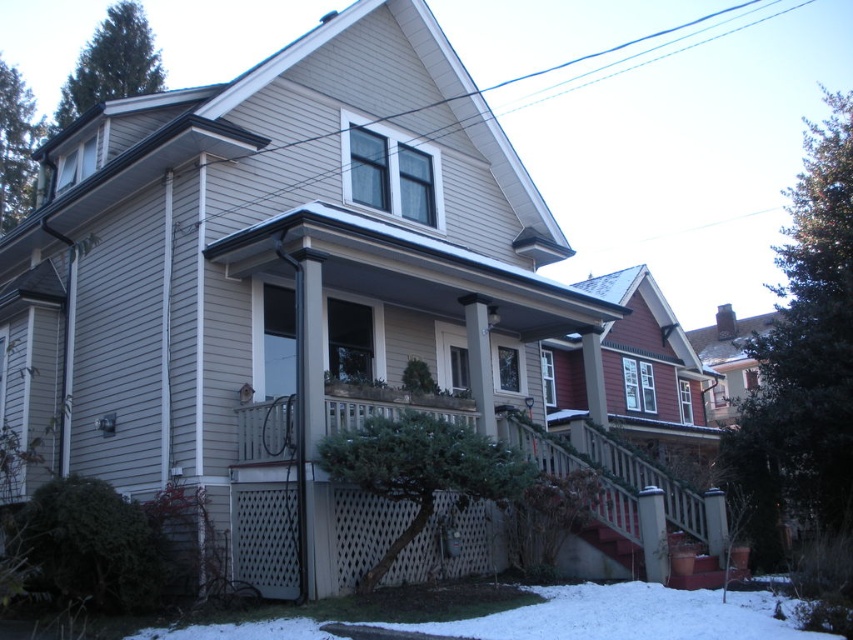
Is point (543, 444) farther from camera compared to point (310, 621)?

Yes, it is.

I want to click on white lattice porch at center, so click(x=619, y=483).

Is point (595, 465) less distant than point (741, 628)?

No, it is behind (741, 628).

Identify the location of white lattice porch at center. The width and height of the screenshot is (853, 640). (619, 483).